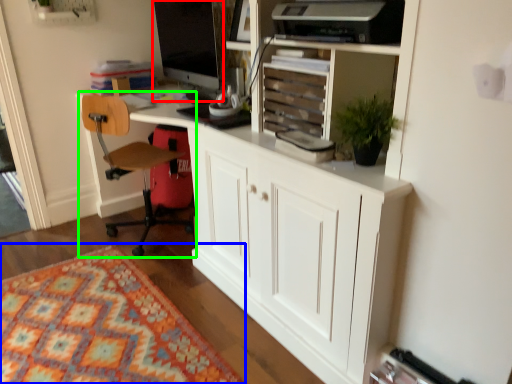
Question: Which object is the farthest from computer monitor (highlighted by a red box)? Choose among these: mat (highlighted by a blue box) or chair (highlighted by a green box).

Choices:
 (A) mat
 (B) chair

Answer: (A)